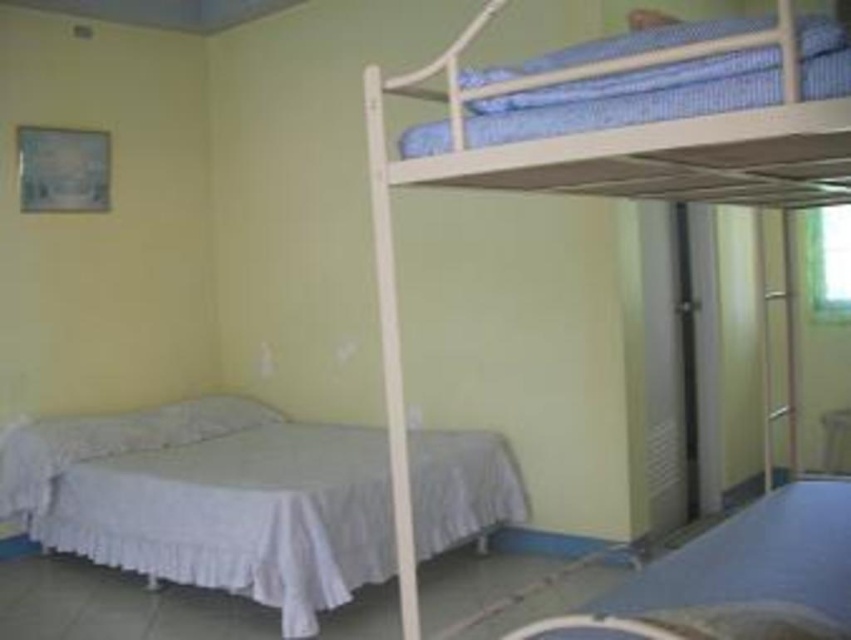
Can you confirm if white fabric bed at lower left is smaller than white wooden bunk bed at upper right?

Actually, white fabric bed at lower left might be larger than white wooden bunk bed at upper right.

You are a GUI agent. You are given a task and a screenshot of the screen. Output one action in this format:
    pyautogui.click(x=<x>, y=<y>)
    Task: Click on the white fabric bed at lower left
    The image size is (851, 640).
    Given the screenshot: What is the action you would take?
    pyautogui.click(x=210, y=499)

Can you confirm if white wooden bunk bed at upper right is positioned to the right of white matte bedcover at lower right?

In fact, white wooden bunk bed at upper right is to the left of white matte bedcover at lower right.

Can you confirm if white wooden bunk bed at upper right is positioned above white matte bedcover at lower right?

Yes, white wooden bunk bed at upper right is above white matte bedcover at lower right.

At what (x,y) coordinates should I click in order to perform the action: click on white wooden bunk bed at upper right. Please return your answer as a coordinate pair (x, y). Looking at the image, I should click on (592, 182).

Where is `white wooden bunk bed at upper right`? This screenshot has width=851, height=640. white wooden bunk bed at upper right is located at coordinates (592, 182).

Does white wooden bunk bed at upper right have a lesser width compared to blue striped pillow at upper right?

No, white wooden bunk bed at upper right is not thinner than blue striped pillow at upper right.

Can you confirm if white wooden bunk bed at upper right is positioned above blue striped pillow at upper right?

Actually, white wooden bunk bed at upper right is below blue striped pillow at upper right.

Does point (686, 196) come farther from viewer compared to point (798, 16)?

Yes, point (686, 196) is farther from viewer.

Identify the location of white wooden bunk bed at upper right. This screenshot has width=851, height=640. [592, 182].